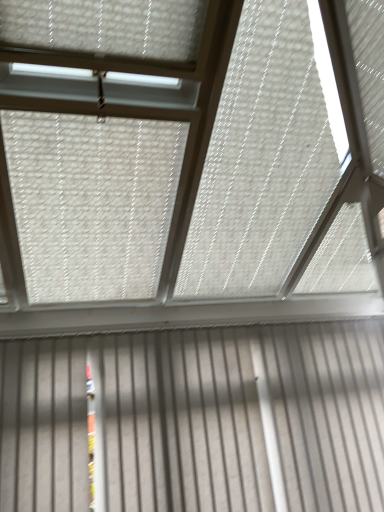
Locate an element on the screen. Image resolution: width=384 pixels, height=512 pixels. metallic gray garage door at lower center is located at coordinates (198, 420).

The image size is (384, 512). What do you see at coordinates (198, 420) in the screenshot?
I see `metallic gray garage door at lower center` at bounding box center [198, 420].

This screenshot has height=512, width=384. I want to click on metallic gray garage door at lower center, so click(198, 420).